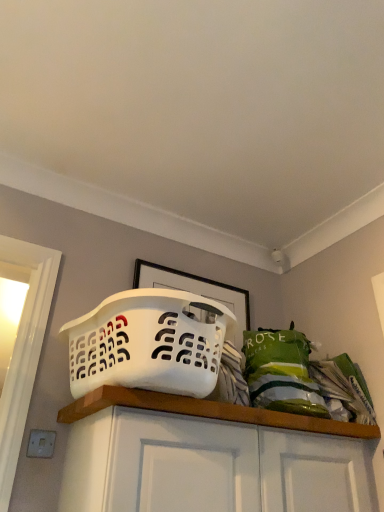
Identify the location of free spot above white matte cabinet at center (from a real-world perspective). The height and width of the screenshot is (512, 384). (282, 410).